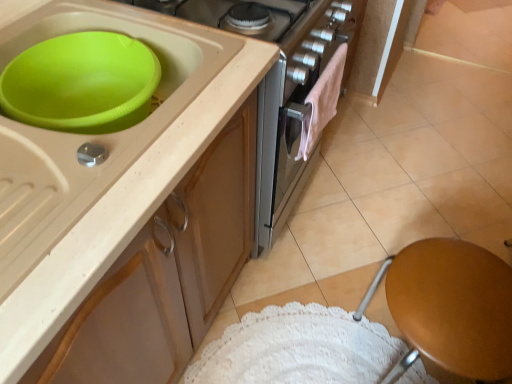
Identify the location of unoccupied area behind brown wooden stool at lower right. Image resolution: width=512 pixels, height=384 pixels. (351, 266).